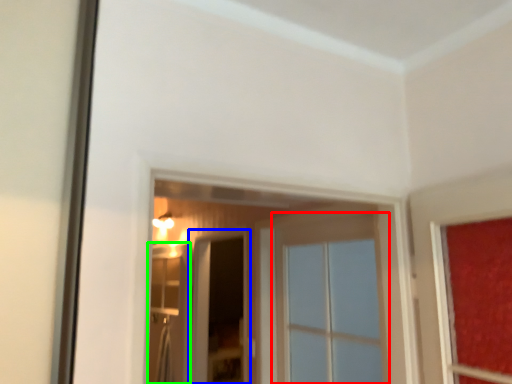
Question: Which object is the closest to the window (highlighted by a red box)? Choose among these: screen door (highlighted by a blue box) or screen door (highlighted by a green box).

Choices:
 (A) screen door
 (B) screen door

Answer: (B)